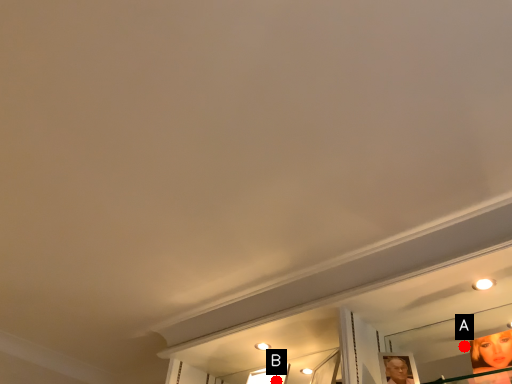
Question: Two points are circled on the image, labeled by A and B beside each circle. Which point is farther to the camera?

Choices:
 (A) A is further
 (B) B is further

Answer: (B)